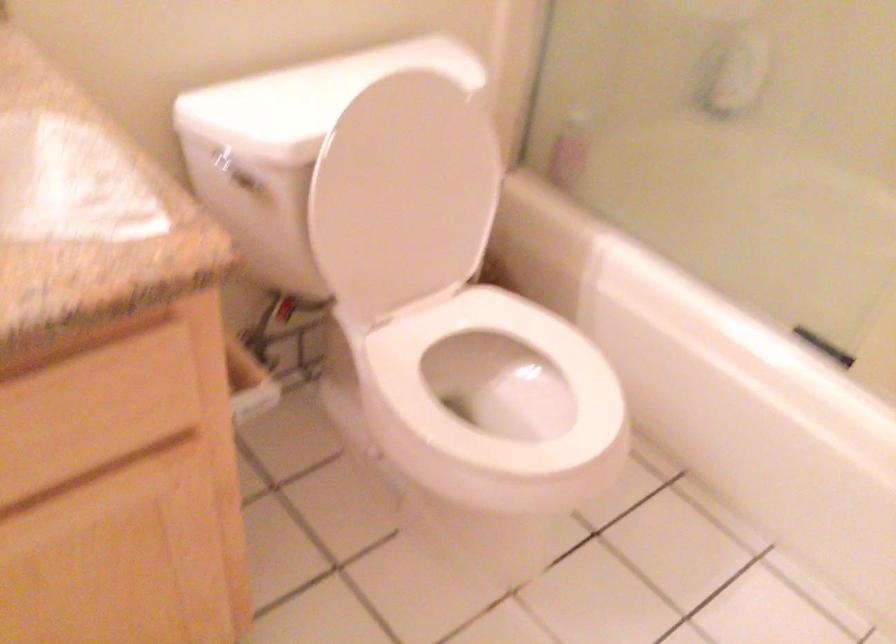
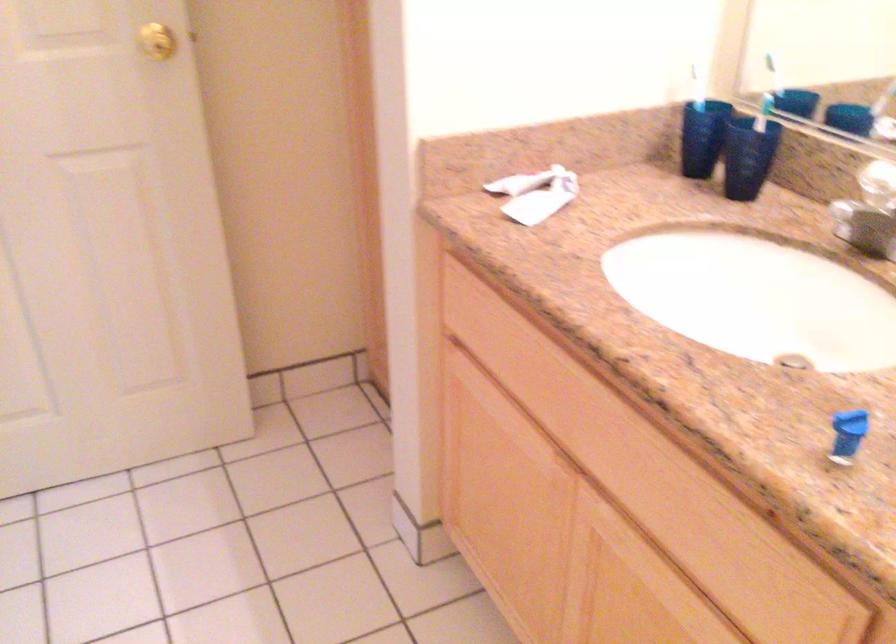
How did the camera likely rotate?

The camera's rotation is toward left-down.